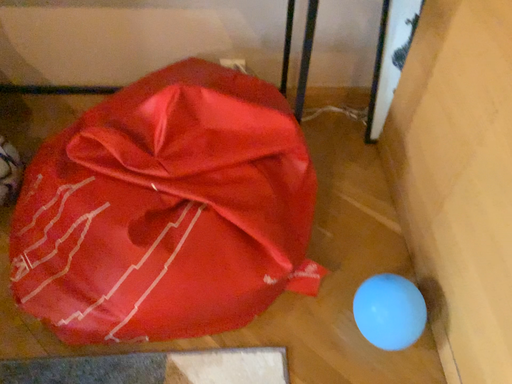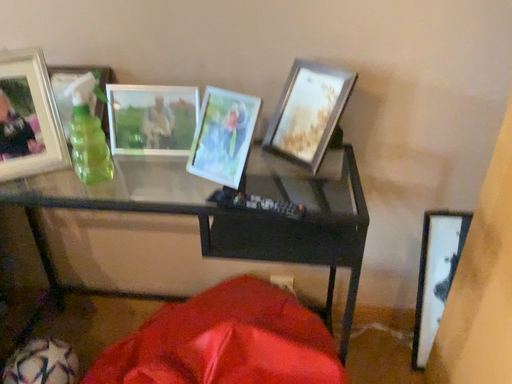
Question: Which way did the camera rotate in the video?

Choices:
 (A) rotated downward
 (B) rotated upward

Answer: (B)